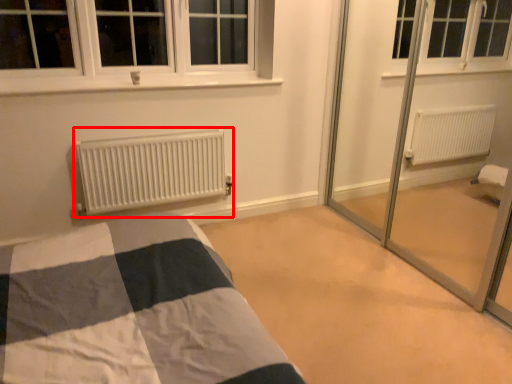
Question: From the image's perspective, what is the correct spatial relationship of heater (annotated by the red box) in relation to plain?

Choices:
 (A) below
 (B) above

Answer: (B)